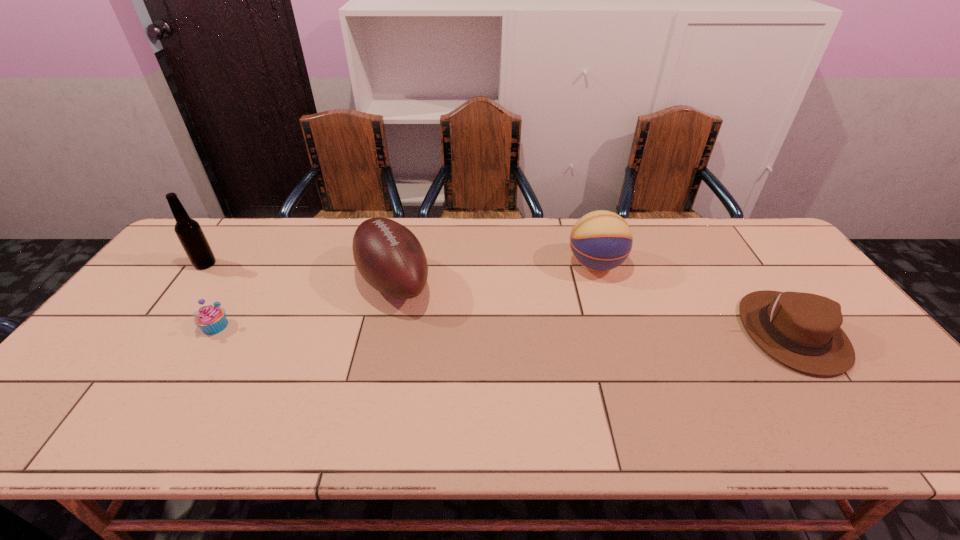
Find the location of a particular element. The image size is (960, 540). the tallest object is located at coordinates (191, 236).

Where is `beer bottle`? beer bottle is located at coordinates (191, 236).

In order to click on the third object from right to left in this screenshot , I will do `click(389, 257)`.

Find the location of a particular element. The image size is (960, 540). basketball is located at coordinates (601, 240).

Identify the location of the second shortest object. (802, 330).

Identify the location of fedora. (802, 330).

Identify the location of the shortest object. The image size is (960, 540). (211, 319).

Identify the location of the second object from left to right. This screenshot has width=960, height=540. (211, 319).

The width and height of the screenshot is (960, 540). Find the location of `vacant space located on the left of the leftmost object`. vacant space located on the left of the leftmost object is located at coordinates (169, 264).

Find the location of a particular element. Image resolution: width=960 pixels, height=540 pixels. vacant space located on the front of the football (American) is located at coordinates (363, 419).